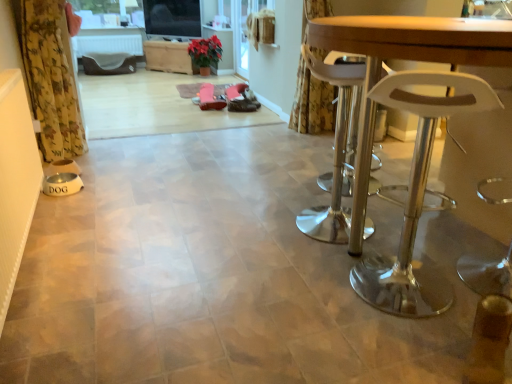
This screenshot has width=512, height=384. Find the location of `vacant space that is to the left of wooden table at right`. vacant space that is to the left of wooden table at right is located at coordinates (195, 299).